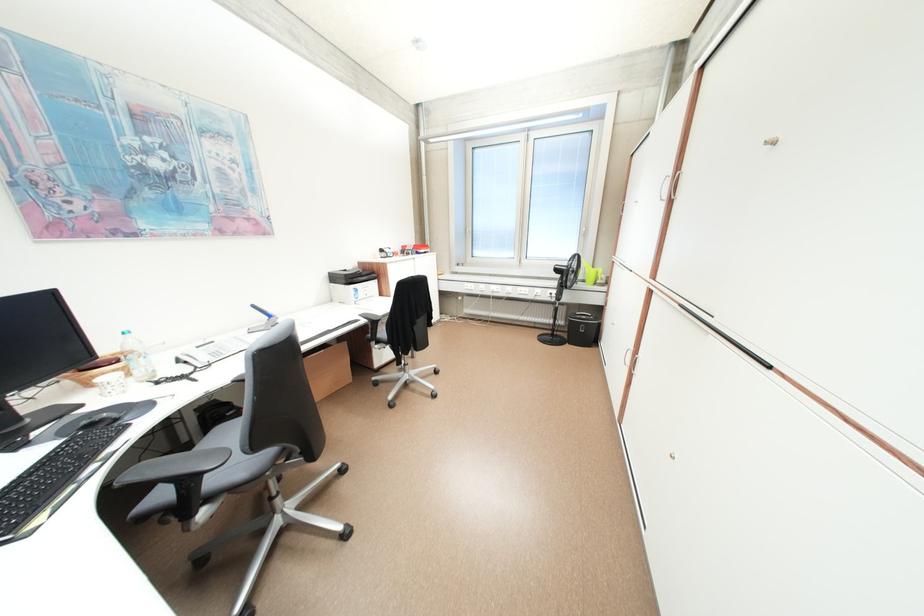
Where would you pour the green pitcher handle? Please return your answer as a coordinate pair (x, y).

(600, 273)